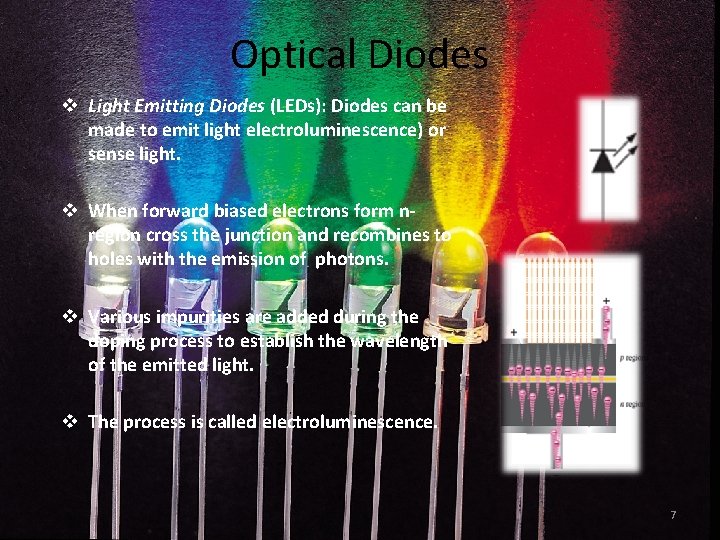
Find the location of a particular element. This screenshot has width=720, height=540. white light is located at coordinates (120, 182).